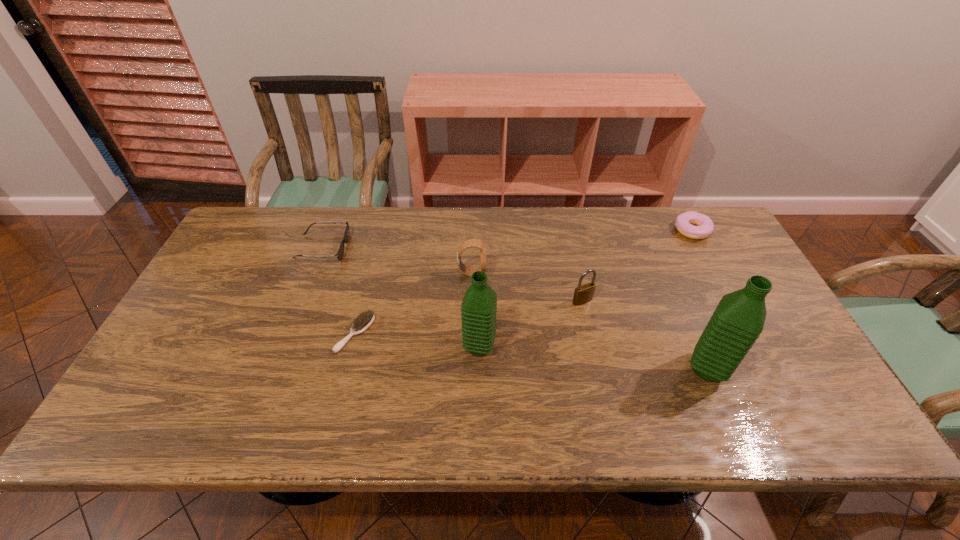
The width and height of the screenshot is (960, 540). Identify the location of object that is at the near edge. (739, 318).

Image resolution: width=960 pixels, height=540 pixels. I want to click on object present at the right edge, so click(x=705, y=227).

You are a GUI agent. You are given a task and a screenshot of the screen. Output one action in this format:
    pyautogui.click(x=<x>, y=<y>)
    Task: Click on the object present at the far right corner
    Image resolution: width=960 pixels, height=540 pixels.
    Given the screenshot: What is the action you would take?
    pyautogui.click(x=705, y=227)

Find the location of a particular element. vacant space at the far edge of the desktop is located at coordinates (593, 219).

This screenshot has width=960, height=540. I want to click on vacant space at the near edge of the desktop, so click(x=351, y=388).

Locate an element on the screen. Image resolution: width=960 pixels, height=540 pixels. vacant region at the left edge of the desktop is located at coordinates (182, 336).

What are the coordinates of `free space at the far left corner` in the screenshot? It's located at (272, 237).

The height and width of the screenshot is (540, 960). In the image, there is a desktop. In order to click on vacant space at the near left corner in this screenshot , I will do `click(178, 387)`.

At what (x,y) coordinates should I click in order to perform the action: click on empty space that is in between the scrubbing brush and the right water bottle. Please return your answer as a coordinate pair (x, y). The height and width of the screenshot is (540, 960). Looking at the image, I should click on (531, 351).

Locate an element on the screen. The height and width of the screenshot is (540, 960). blank region between the right water bottle and the rightmost object is located at coordinates (700, 300).